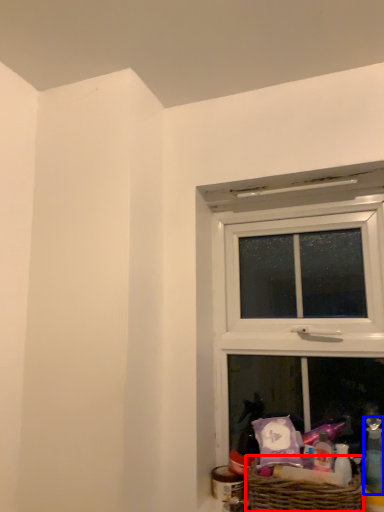
Question: Which of the following is the closest to the observer, picnic basket (highlighted by a red box) or toiletry (highlighted by a blue box)?

Choices:
 (A) picnic basket
 (B) toiletry

Answer: (A)